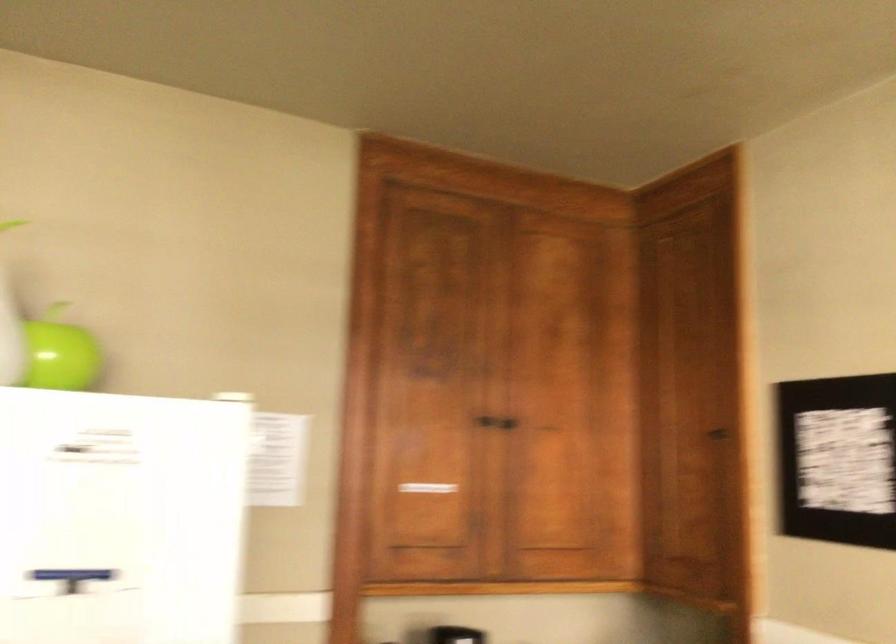
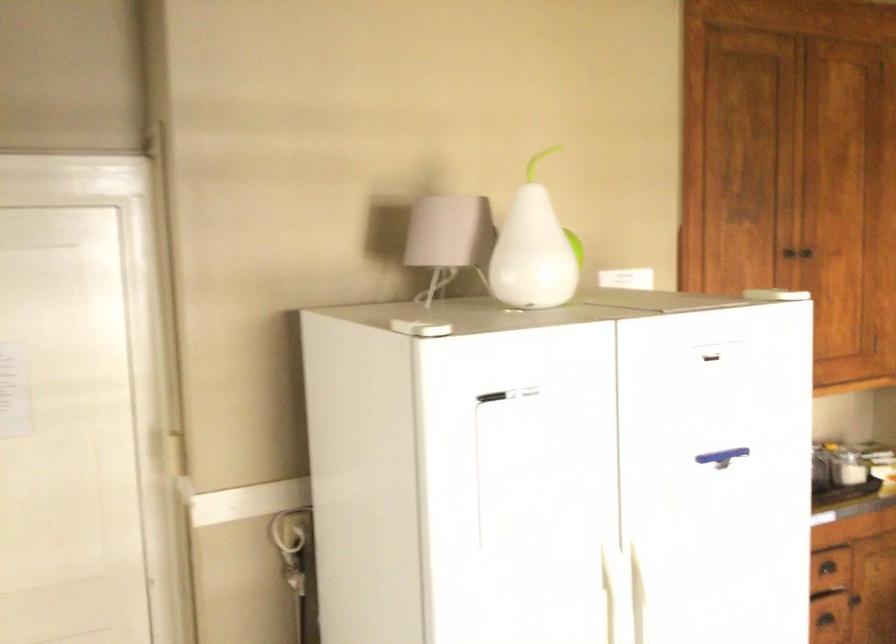
Question: What movement of the cameraman would produce the second image?

Choices:
 (A) Left
 (B) Right
 (C) Forward
 (D) Backward

Answer: (A)